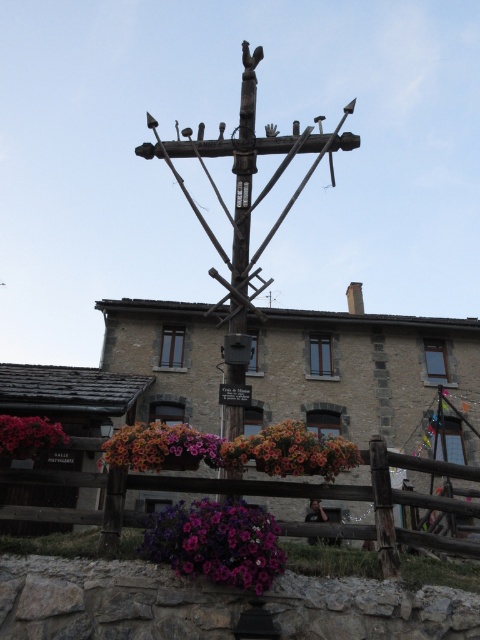
You are standing in front of the wooden cross at center and want to place a small statue on the ground between it and the vibrant floral basket at center. If the statue is 1 meter tall, will it be shorter than both objects?

The wooden cross at center has a greater height compared to vibrant floral basket at center. Since the statue is 1 meter tall, it will be shorter than both objects only if both are taller than 1 meter. However, the description only states the cross is taller than the basket, but does not provide specific measurements for either. Therefore, we cannot definitively conclude if the statue will be shorter than both based on the given information.

You are standing in front of the rustic wooden structure and want to place a small decoration between the two points labeled as point (267, 440) and point (142, 433). Based on their positions, which point is closer to you where you should place the decoration?

Point (142, 433) is closer to you, so you should place the decoration near that point since it is nearer compared to point (267, 440) which is further away.